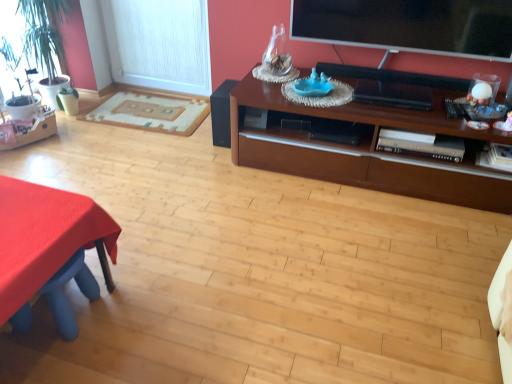
Question: From the image's perspective, relative to flat screen tv at upper right, is beige woven rug at left above or below?

Choices:
 (A) below
 (B) above

Answer: (A)

Question: Based on their positions, is beige woven rug at left located to the left or right of flat screen tv at upper right?

Choices:
 (A) right
 (B) left

Answer: (B)

Question: Estimate the real-world distances between objects in this image. Which object is closer to the beige woven rug at left?

Choices:
 (A) flat screen tv at upper right
 (B) brown wood cabinet at upper right
 (C) green leafy plant at left
 (D) matte black speaker at center
 (E) white textured window screen at left

Answer: (E)

Question: Which is farther from the white textured window screen at left?

Choices:
 (A) green leafy plant at left
 (B) brown wood cabinet at upper right
 (C) matte black speaker at center
 (D) red fabric table at lower left
 (E) flat screen tv at upper right

Answer: (D)